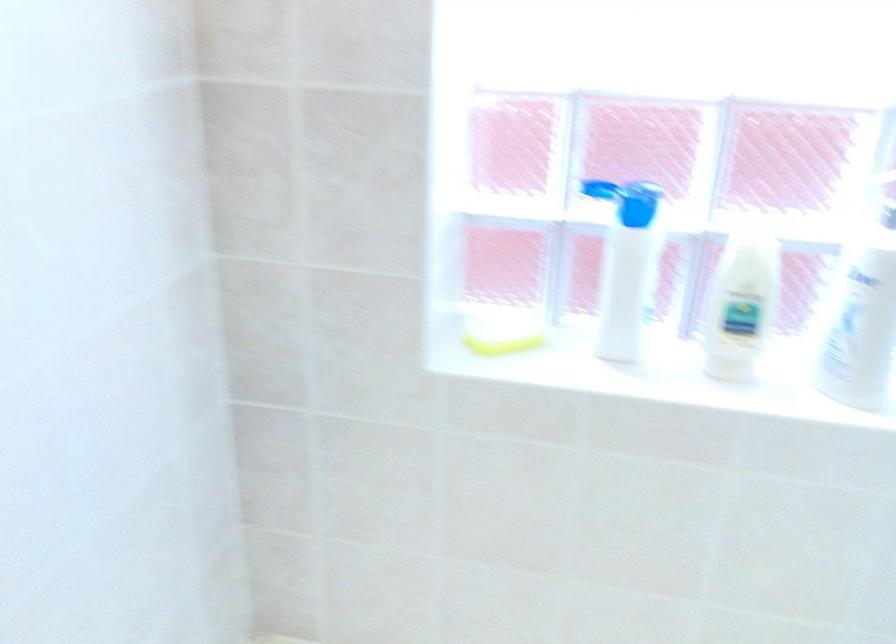
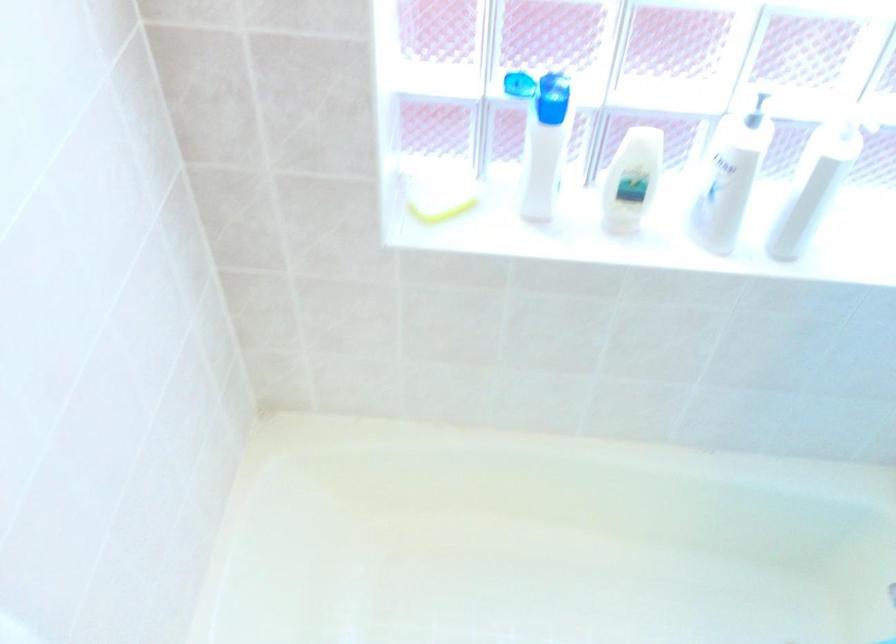
Question: The images are taken continuously from a first-person perspective. In which direction is your viewpoint rotating?

Choices:
 (A) Left
 (B) Right
 (C) Up
 (D) Down

Answer: (D)